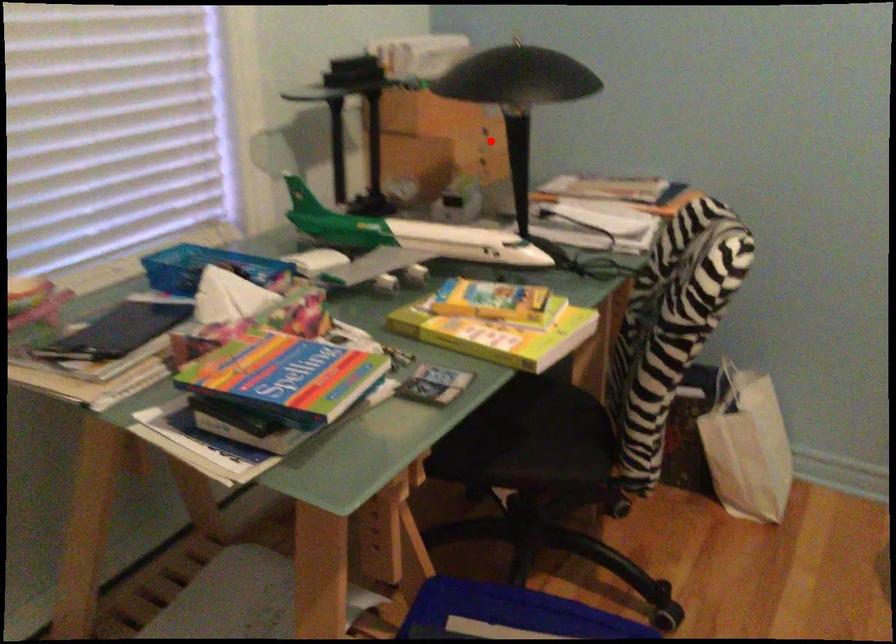
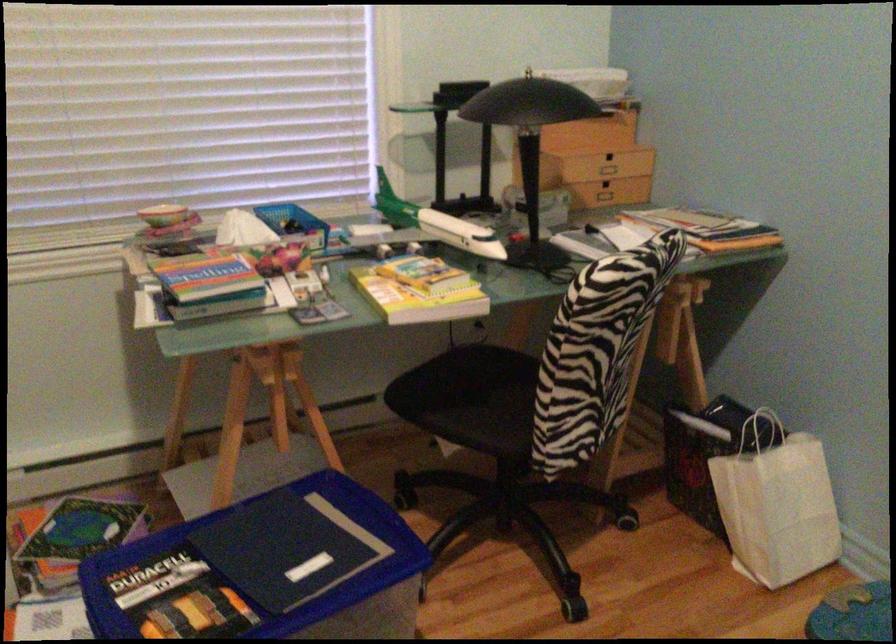
Where in the second image is the point corresponding to the highlighted location from the first image?

(610, 166)